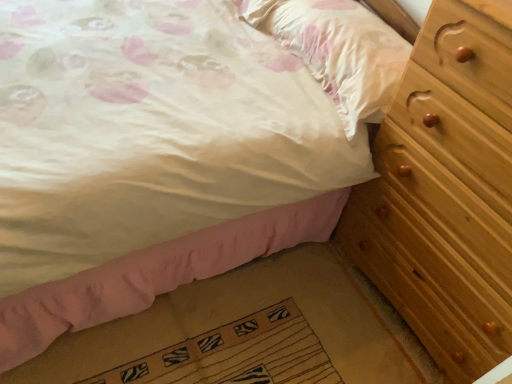
Question: Is light brown wooden chest of drawers at right placed right next to matte white pillow at upper right?

Choices:
 (A) no
 (B) yes

Answer: (A)

Question: Can you confirm if light brown wooden chest of drawers at right is thinner than matte white pillow at upper right?

Choices:
 (A) no
 (B) yes

Answer: (A)

Question: Is light brown wooden chest of drawers at right not inside matte white pillow at upper right?

Choices:
 (A) yes
 (B) no

Answer: (A)

Question: Considering the relative sizes of light brown wooden chest of drawers at right and matte white pillow at upper right in the image provided, is light brown wooden chest of drawers at right shorter than matte white pillow at upper right?

Choices:
 (A) yes
 (B) no

Answer: (B)

Question: From the image's perspective, is light brown wooden chest of drawers at right under matte white pillow at upper right?

Choices:
 (A) yes
 (B) no

Answer: (A)

Question: Considering the positions of matte white pillow at upper right and light brown wooden chest of drawers at right in the image, is matte white pillow at upper right bigger or smaller than light brown wooden chest of drawers at right?

Choices:
 (A) small
 (B) big

Answer: (A)

Question: Considering the relative positions of matte white pillow at upper right and light brown wooden chest of drawers at right in the image provided, is matte white pillow at upper right to the left or to the right of light brown wooden chest of drawers at right?

Choices:
 (A) right
 (B) left

Answer: (B)

Question: From the image's perspective, is matte white pillow at upper right located above or below light brown wooden chest of drawers at right?

Choices:
 (A) below
 (B) above

Answer: (B)

Question: Considering the positions of matte white pillow at upper right and light brown wooden chest of drawers at right in the image, is matte white pillow at upper right wider or thinner than light brown wooden chest of drawers at right?

Choices:
 (A) thin
 (B) wide

Answer: (A)

Question: In terms of height, does matte white pillow at upper right look taller or shorter compared to wooden bed frame at lower right?

Choices:
 (A) short
 (B) tall

Answer: (B)

Question: Looking at the image, does matte white pillow at upper right seem bigger or smaller compared to wooden bed frame at lower right?

Choices:
 (A) small
 (B) big

Answer: (A)

Question: From a real-world perspective, is matte white pillow at upper right physically located above or below wooden bed frame at lower right?

Choices:
 (A) below
 (B) above

Answer: (B)

Question: Is matte white pillow at upper right in front of or behind wooden bed frame at lower right in the image?

Choices:
 (A) front
 (B) behind

Answer: (B)

Question: Considering their positions, is textured beige mat at lower center located in front of or behind wooden bed frame at lower right?

Choices:
 (A) behind
 (B) front

Answer: (A)

Question: In the image, is textured beige mat at lower center on the left side or the right side of wooden bed frame at lower right?

Choices:
 (A) right
 (B) left

Answer: (A)